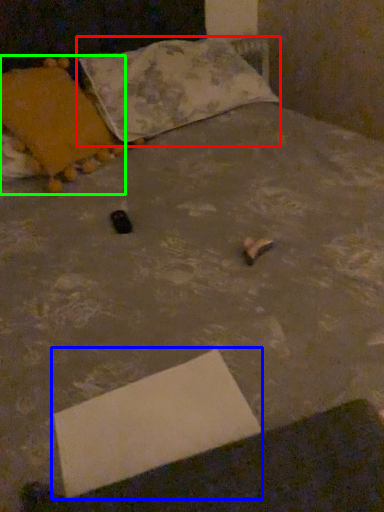
Question: Based on their relative distances, which object is farther from pillow (highlighted by a red box)? Choose from cardboard box (highlighted by a blue box) and pillow (highlighted by a green box).

Choices:
 (A) cardboard box
 (B) pillow

Answer: (A)